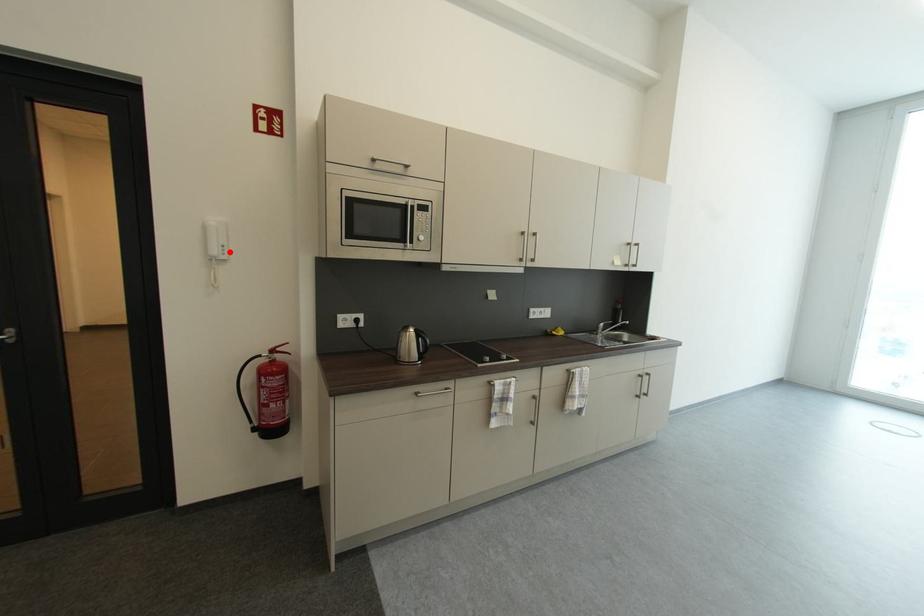
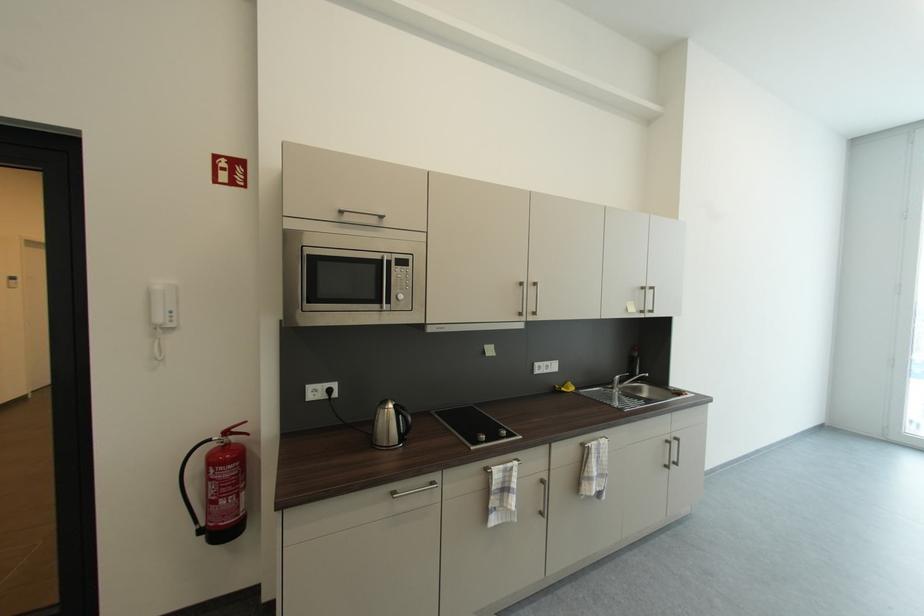
Find the pixel in the second image that matches the highlighted location in the first image.

(177, 318)